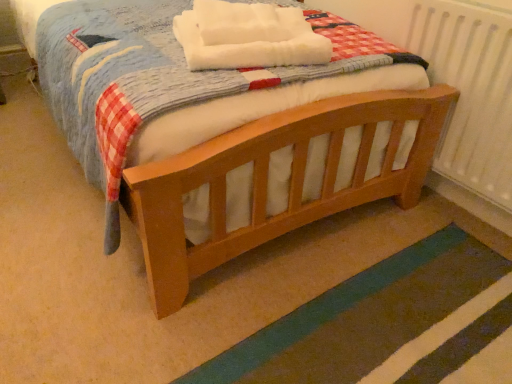
Question: From a real-world perspective, is teal rug at lower right physically above white textured radiator at right?

Choices:
 (A) no
 (B) yes

Answer: (A)

Question: From a real-world perspective, is teal rug at lower right positioned under white textured radiator at right based on gravity?

Choices:
 (A) yes
 (B) no

Answer: (A)

Question: Considering the relative sizes of teal rug at lower right and white textured radiator at right in the image provided, is teal rug at lower right taller than white textured radiator at right?

Choices:
 (A) yes
 (B) no

Answer: (B)

Question: Is white textured radiator at right at the back of teal rug at lower right?

Choices:
 (A) no
 (B) yes

Answer: (A)

Question: Is teal rug at lower right smaller than white textured radiator at right?

Choices:
 (A) no
 (B) yes

Answer: (B)

Question: From the image's perspective, is teal rug at lower right below white textured radiator at right?

Choices:
 (A) yes
 (B) no

Answer: (A)

Question: Considering the relative sizes of white textured radiator at right and teal rug at lower right in the image provided, is white textured radiator at right shorter than teal rug at lower right?

Choices:
 (A) yes
 (B) no

Answer: (B)

Question: Is white textured radiator at right facing towards teal rug at lower right?

Choices:
 (A) no
 (B) yes

Answer: (B)

Question: Is white textured radiator at right wider than teal rug at lower right?

Choices:
 (A) yes
 (B) no

Answer: (B)

Question: Is white textured radiator at right looking in the opposite direction of teal rug at lower right?

Choices:
 (A) yes
 (B) no

Answer: (B)

Question: Is white textured radiator at right completely or partially outside of teal rug at lower right?

Choices:
 (A) no
 (B) yes

Answer: (B)

Question: Is the position of white textured radiator at right more distant than that of teal rug at lower right?

Choices:
 (A) yes
 (B) no

Answer: (A)

Question: Can you confirm if white soft blanket at center is shorter than wooden bed at center?

Choices:
 (A) no
 (B) yes

Answer: (A)